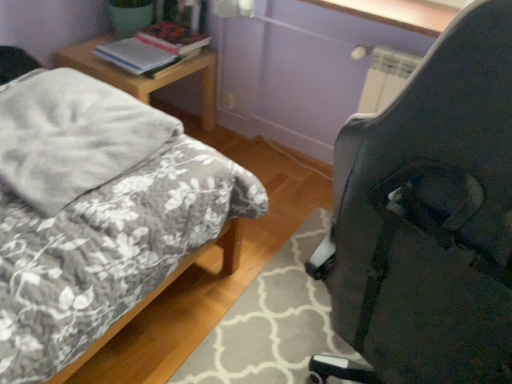
Question: Would you consider white glossy window sill at upper center to be distant from woodennightstand at left?

Choices:
 (A) no
 (B) yes

Answer: (A)

Question: From the image's perspective, is white glossy window sill at upper center located beneath woodennightstand at left?

Choices:
 (A) no
 (B) yes

Answer: (A)

Question: Is white glossy window sill at upper center oriented towards woodennightstand at left?

Choices:
 (A) no
 (B) yes

Answer: (A)

Question: Considering the relative sizes of white glossy window sill at upper center and woodennightstand at left in the image provided, is white glossy window sill at upper center thinner than woodennightstand at left?

Choices:
 (A) no
 (B) yes

Answer: (B)

Question: Is white glossy window sill at upper center bigger than woodennightstand at left?

Choices:
 (A) yes
 (B) no

Answer: (B)

Question: From a real-world perspective, does white glossy window sill at upper center sit lower than woodennightstand at left?

Choices:
 (A) no
 (B) yes

Answer: (A)

Question: Can you confirm if gray soft blanket at left is taller than hardcover book at upper left, which appears as the second book when viewed from the front?

Choices:
 (A) yes
 (B) no

Answer: (A)

Question: From the image's perspective, does gray soft blanket at left appear lower than hardcover book at upper left, marked as the first book in a back-to-front arrangement?

Choices:
 (A) yes
 (B) no

Answer: (A)

Question: Could hardcover book at upper left, which appears as the second book when viewed from the front, be considered to be inside gray soft blanket at left?

Choices:
 (A) yes
 (B) no

Answer: (B)

Question: Can we say gray soft blanket at left lies outside hardcover book at upper left, marked as the first book in a back-to-front arrangement?

Choices:
 (A) no
 (B) yes

Answer: (B)

Question: Is gray soft blanket at left positioned with its back to hardcover book at upper left, marked as the first book in a back-to-front arrangement?

Choices:
 (A) no
 (B) yes

Answer: (A)

Question: Does gray soft blanket at left appear on the right side of hardcover book at upper left, marked as the first book in a back-to-front arrangement?

Choices:
 (A) no
 (B) yes

Answer: (A)

Question: From a real-world perspective, is black plastic chair at right beneath hardcover book at upper left, which appears as the second book when viewed from the front?

Choices:
 (A) no
 (B) yes

Answer: (A)